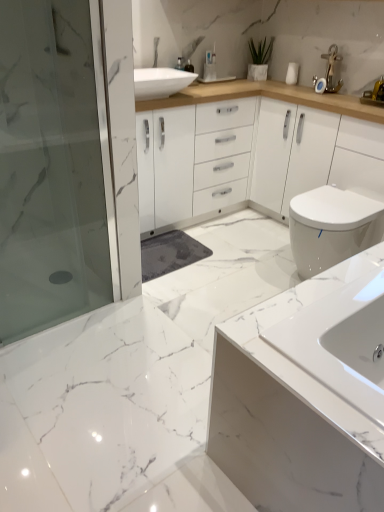
You are a GUI agent. You are given a task and a screenshot of the screen. Output one action in this format:
    pyautogui.click(x=<x>, y=<y>)
    Task: Click on the free area behind transparent glass shower door at left
    
    Given the screenshot: What is the action you would take?
    tap(81, 302)